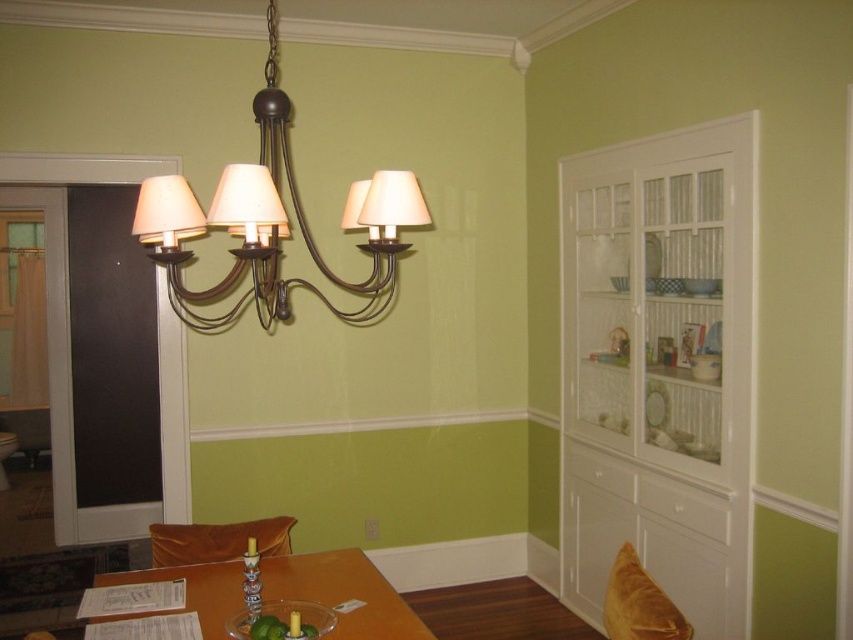
Who is positioned more to the right, velvet orange chair at lower center or velvet yellow pillow at lower right?

velvet yellow pillow at lower right

Who is more forward, (283, 516) or (625, 568)?

Point (625, 568) is in front.

This screenshot has height=640, width=853. I want to click on velvet orange chair at lower center, so click(218, 540).

Where is `velvet orange chair at lower center`? velvet orange chair at lower center is located at coordinates (218, 540).

Looking at this image, is velvet yellow pillow at lower right further to the viewer compared to clear glass bowl at lower center?

No, velvet yellow pillow at lower right is closer to the viewer.

Image resolution: width=853 pixels, height=640 pixels. What do you see at coordinates (639, 604) in the screenshot?
I see `velvet yellow pillow at lower right` at bounding box center [639, 604].

What do you see at coordinates (639, 604) in the screenshot? The image size is (853, 640). I see `velvet yellow pillow at lower right` at bounding box center [639, 604].

At what (x,y) coordinates should I click in order to perform the action: click on velvet yellow pillow at lower right. Please return your answer as a coordinate pair (x, y). The height and width of the screenshot is (640, 853). Looking at the image, I should click on (639, 604).

Does matte bronze chandelier at upper center appear on the left side of velvet orange chair at lower center?

No, matte bronze chandelier at upper center is not to the left of velvet orange chair at lower center.

Can you confirm if matte bronze chandelier at upper center is wider than velvet orange chair at lower center?

Yes, matte bronze chandelier at upper center is wider than velvet orange chair at lower center.

Which is in front, point (379, 177) or point (291, 518)?

Point (379, 177)

Identify the location of matte bronze chandelier at upper center. The height and width of the screenshot is (640, 853). (273, 221).